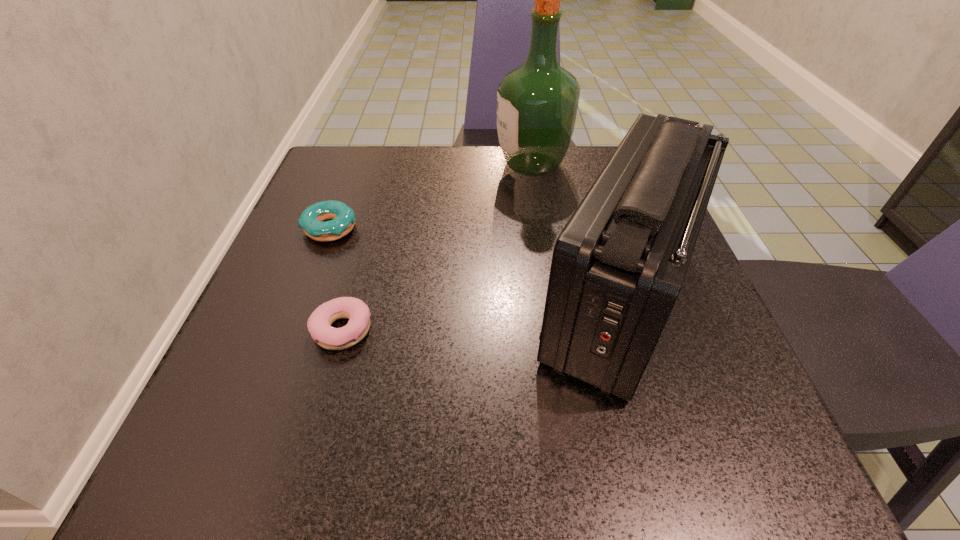
Locate which object is the closest to the farther doughnut. Please provide its 2D coordinates. Your answer should be formatted as a tuple, i.e. [(x, y)], where the tuple contains the x and y coordinates of a point satisfying the conditions above.

[(319, 323)]

Find the location of `vacant space that satisfies the following two spatial constraints: 1. on the front panel of the radio receiver; 2. on the front side of the nearer doughnut`. vacant space that satisfies the following two spatial constraints: 1. on the front panel of the radio receiver; 2. on the front side of the nearer doughnut is located at coordinates (627, 330).